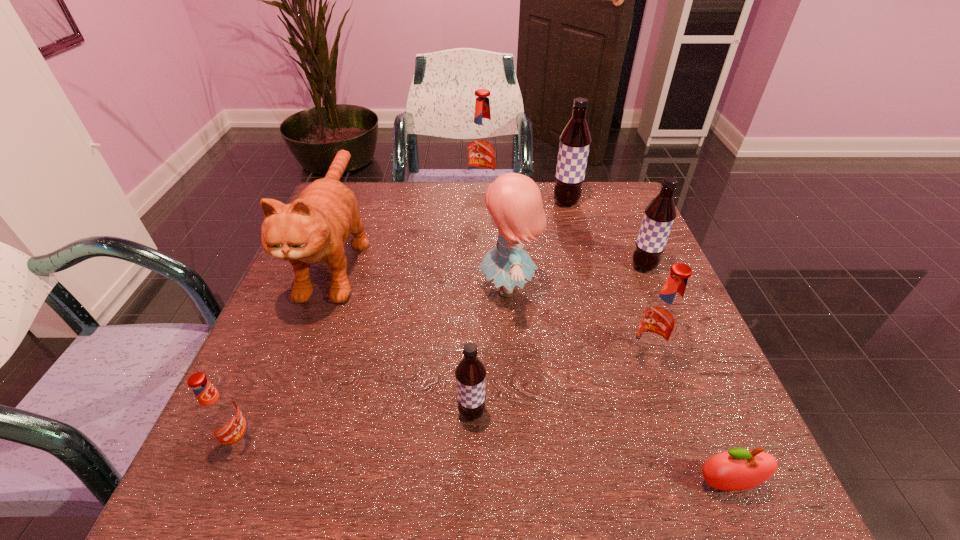
Where is `free region at the right edge of the desktop`? The width and height of the screenshot is (960, 540). free region at the right edge of the desktop is located at coordinates (671, 423).

Where is `vacant space at the far left corner of the desktop`? The height and width of the screenshot is (540, 960). vacant space at the far left corner of the desktop is located at coordinates pos(380,193).

Image resolution: width=960 pixels, height=540 pixels. In order to click on vacant area that lies between the second red root beer from right to left and the nearest object in this screenshot , I will do `click(604, 338)`.

Find the location of a particular element. The image size is (960, 540). empty space between the biggest brown root beer and the cat is located at coordinates (452, 230).

You are a GUI agent. You are given a task and a screenshot of the screen. Output one action in this format:
    pyautogui.click(x=<x>, y=<y>)
    Task: Click on the vacant point located between the rightmost root beer and the shortest object
    Image resolution: width=960 pixels, height=540 pixels.
    Given the screenshot: What is the action you would take?
    pyautogui.click(x=684, y=376)

You are a GUI agent. You are given a task and a screenshot of the screen. Output one action in this format:
    pyautogui.click(x=<x>, y=<y>)
    Task: Click on the vacant area that lies between the blue doll and the nearest object
    The width and height of the screenshot is (960, 540).
    Given the screenshot: What is the action you would take?
    pyautogui.click(x=617, y=387)

The width and height of the screenshot is (960, 540). I want to click on unoccupied position between the seventh farthest object and the rightmost root beer, so click(x=558, y=340).

This screenshot has width=960, height=540. In order to click on vacant space that is in between the nearest brown root beer and the nearest object in this screenshot , I will do `click(599, 449)`.

Identify the location of vacant area that lies between the cat and the farthest brown root beer. The height and width of the screenshot is (540, 960). (452, 230).

You are a GUI agent. You are given a task and a screenshot of the screen. Output one action in this format:
    pyautogui.click(x=<x>, y=<y>)
    Task: Click on the vacant area between the shortest object and the second nearest object
    The height and width of the screenshot is (540, 960).
    Given the screenshot: What is the action you would take?
    pyautogui.click(x=483, y=463)